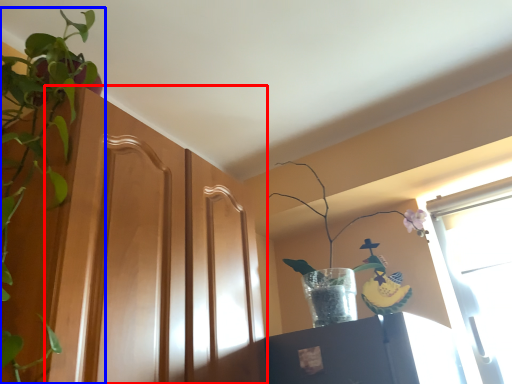
Question: Among these objects, which one is nearest to the camera, screen door (highlighted by a red box) or houseplant (highlighted by a blue box)?

Choices:
 (A) screen door
 (B) houseplant

Answer: (B)